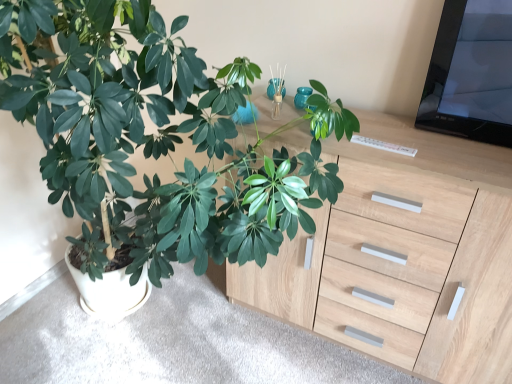
From the picture: Measure the distance between point [120,352] and camera.

Point [120,352] is 5.46 feet away from camera.

Describe the element at coordinates (405, 256) in the screenshot. I see `light wood chest of drawers at center` at that location.

The height and width of the screenshot is (384, 512). Identify the location of green matte plant at left. (152, 137).

From a real-world perspective, is matte wood cabinet at lower center physically below green matte plant at left?

Indeed, from a real-world perspective, matte wood cabinet at lower center is positioned beneath green matte plant at left.

Find the location of a particular element. The width and height of the screenshot is (512, 384). houseplant above the matte wood cabinet at lower center (from a real-world perspective) is located at coordinates coord(152,137).

Is point (176, 304) positioned behind point (93, 63)?

Yes, it is.

Based on the photo, from the image's perspective, is light wood chest of drawers at center under matte wood cabinet at lower center?

No, from the image's perspective, light wood chest of drawers at center is not beneath matte wood cabinet at lower center.

Does light wood chest of drawers at center appear on the right side of matte wood cabinet at lower center?

Yes.

From a real-world perspective, is light wood chest of drawers at center physically located above or below matte wood cabinet at lower center?

Clearly, from a real-world perspective, light wood chest of drawers at center is above matte wood cabinet at lower center.

Is light wood chest of drawers at center turned away from matte wood cabinet at lower center?

light wood chest of drawers at center is not turned away from matte wood cabinet at lower center.

Can you confirm if green matte plant at left is smaller than light wood chest of drawers at center?

No, green matte plant at left is not smaller than light wood chest of drawers at center.

Between green matte plant at left and light wood chest of drawers at center, which one has smaller width?

With smaller width is light wood chest of drawers at center.

The image size is (512, 384). What are the coordinates of `houseplant that is above the light wood chest of drawers at center (from the image's perspective)` in the screenshot? It's located at (152, 137).

From a real-world perspective, is green matte plant at left physically located above or below light wood chest of drawers at center?

From a real-world perspective, green matte plant at left is physically above light wood chest of drawers at center.

Is green matte plant at left aimed at matte wood cabinet at lower center?

No, green matte plant at left is not oriented towards matte wood cabinet at lower center.

Consider the image. Are green matte plant at left and matte wood cabinet at lower center making contact?

No, green matte plant at left is not beside matte wood cabinet at lower center.

Looking at this image, is green matte plant at left closer to the viewer compared to matte wood cabinet at lower center?

Yes, it is.

Does point (237, 275) come behind point (324, 131)?

Yes, point (237, 275) is farther from viewer.

In terms of height, does light wood chest of drawers at center look taller or shorter compared to green matte plant at left?

In the image, light wood chest of drawers at center appears to be shorter than green matte plant at left.

Is light wood chest of drawers at center positioned with its back to green matte plant at left?

No, light wood chest of drawers at center is not facing away from green matte plant at left.

How different are the orientations of light wood chest of drawers at center and green matte plant at left in degrees?

The facing directions of light wood chest of drawers at center and green matte plant at left are 1.15 degrees apart.

Can you confirm if matte wood cabinet at lower center is taller than light wood chest of drawers at center?

Incorrect, the height of matte wood cabinet at lower center is not larger of that of light wood chest of drawers at center.

Considering the sizes of objects matte wood cabinet at lower center and light wood chest of drawers at center in the image provided, who is smaller, matte wood cabinet at lower center or light wood chest of drawers at center?

Smaller between the two is matte wood cabinet at lower center.

Considering the sizes of objects matte wood cabinet at lower center and light wood chest of drawers at center in the image provided, who is thinner, matte wood cabinet at lower center or light wood chest of drawers at center?

light wood chest of drawers at center.

Which point is more distant from viewer, [241,356] or [403,354]?

The point [241,356] is more distant.

The width and height of the screenshot is (512, 384). I want to click on gray that is under the green matte plant at left (from a real-world perspective), so 172,342.

Where is `gray behind the light wood chest of drawers at center`? The height and width of the screenshot is (384, 512). gray behind the light wood chest of drawers at center is located at coordinates (x=172, y=342).

Which object lies further to the anchor point green matte plant at left, matte wood cabinet at lower center or light wood chest of drawers at center?

The object further to green matte plant at left is matte wood cabinet at lower center.

Which object lies further to the anchor point light wood chest of drawers at center, green matte plant at left or matte wood cabinet at lower center?

matte wood cabinet at lower center lies further to light wood chest of drawers at center than the other object.

Estimate the real-world distances between objects in this image. Which object is closer to matte wood cabinet at lower center, green matte plant at left or light wood chest of drawers at center?

Based on the image, light wood chest of drawers at center appears to be nearer to matte wood cabinet at lower center.

Based on their spatial positions, is matte wood cabinet at lower center or green matte plant at left further from light wood chest of drawers at center?

matte wood cabinet at lower center.

Considering their positions, is light wood chest of drawers at center positioned closer to matte wood cabinet at lower center than green matte plant at left?

The object closer to matte wood cabinet at lower center is light wood chest of drawers at center.

Estimate the real-world distances between objects in this image. Which object is closer to green matte plant at left, light wood chest of drawers at center or matte wood cabinet at lower center?

Based on the image, light wood chest of drawers at center appears to be nearer to green matte plant at left.

You are a GUI agent. You are given a task and a screenshot of the screen. Output one action in this format:
    pyautogui.click(x=<x>, y=<y>)
    Task: Click on the gray between green matte plant at left and light wood chest of drawers at center
    
    Given the screenshot: What is the action you would take?
    (172, 342)